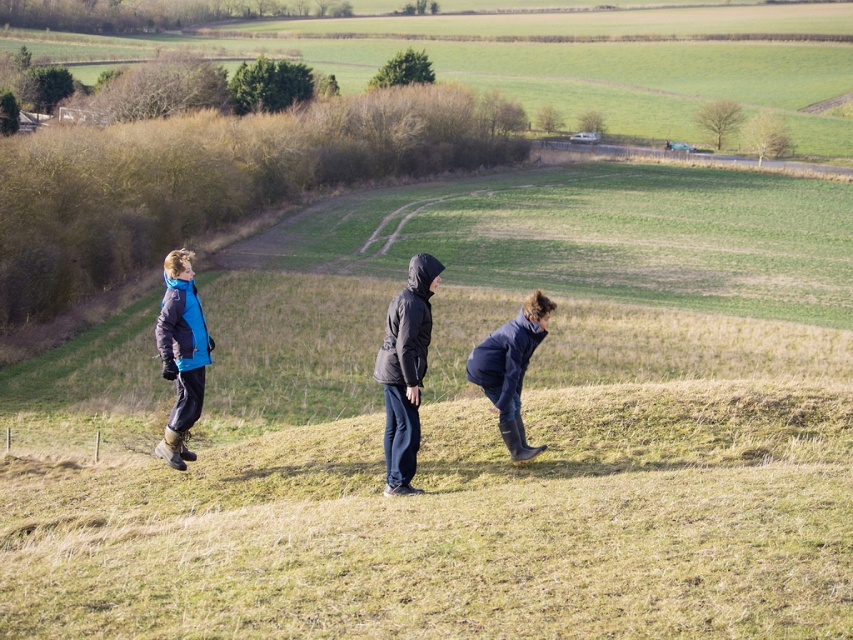
Looking at this image, does black quilted jacket at center come behind matte blue jacket at left?

That is False.

At what (x,y) coordinates should I click in order to perform the action: click on black quilted jacket at center. Please return your answer as a coordinate pair (x, y). Image resolution: width=853 pixels, height=640 pixels. Looking at the image, I should click on (405, 371).

Locate an element on the screen. Image resolution: width=853 pixels, height=640 pixels. black quilted jacket at center is located at coordinates (405, 371).

Is point (421, 362) less distant than point (469, 355)?

That is True.

The image size is (853, 640). In order to click on black quilted jacket at center in this screenshot , I will do `click(405, 371)`.

The height and width of the screenshot is (640, 853). What do you see at coordinates (181, 353) in the screenshot?
I see `matte blue jacket at left` at bounding box center [181, 353].

Who is shorter, matte blue jacket at left or dark blue rubber boots at center?

matte blue jacket at left is shorter.

Does point (173, 333) come farther from viewer compared to point (477, 365)?

That is True.

Locate an element on the screen. The width and height of the screenshot is (853, 640). matte blue jacket at left is located at coordinates (181, 353).